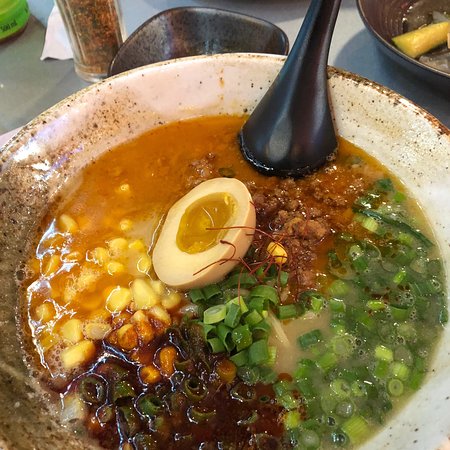
I want to click on flat black soup spoon for eating noodles, so click(x=271, y=132).